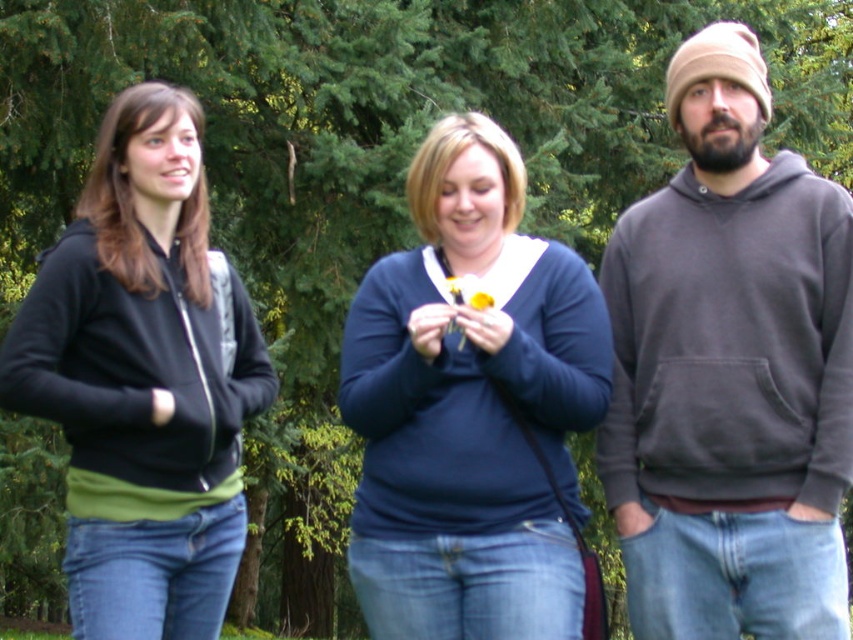
You are a photographer trying to capture a group photo of the blue matte sweater at center and the yellow matte flower at center. Since you want both subjects to be clearly visible, which one should you focus on first to ensure proper framing?

The blue matte sweater at center should be focused on first because it is wider than the yellow matte flower at center, ensuring it fits within the frame properly before adjusting for the smaller subject.

You are a photographer setting up a photo shoot in a park. You have two hoodies to place in the scene for a photoshoot setup. The gray hoodie at right and the black matte hoodie at left. Based on their sizes, which hoodie should you place on a higher shelf to ensure they look proportional in the image?

The gray hoodie at right is much taller than the black matte hoodie at left, so placing the gray hoodie at right on a higher shelf would maintain proportionality in the image.

You are trying to decide which hoodie to borrow from your friends. Both the gray hoodie at right and the black matte hoodie at left are available. If you prefer a larger hoodie, which one should you choose?

The gray hoodie at right is larger in size compared to the black matte hoodie at left, so you should choose the gray hoodie at right.